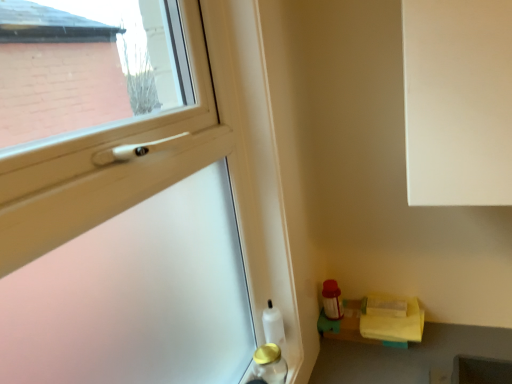
Image resolution: width=512 pixels, height=384 pixels. I want to click on transparent plastic screen door at lower right, so click(x=136, y=297).

This screenshot has width=512, height=384. I want to click on gold metallic bottle at lower left, which appears as the first bottle when viewed from the front, so click(269, 364).

Based on the photo, does gold metallic bottle at lower left, which appears as the 2th bottle when viewed from the back, touch yellow fabric at lower right?

gold metallic bottle at lower left, which appears as the 2th bottle when viewed from the back, is not next to yellow fabric at lower right, and they're not touching.

From the image's perspective, relative to yellow fabric at lower right, is gold metallic bottle at lower left, which appears as the 2th bottle when viewed from the back, above or below?

Clearly, from the image's perspective, gold metallic bottle at lower left, which appears as the 2th bottle when viewed from the back, is below yellow fabric at lower right.

Is gold metallic bottle at lower left, which appears as the 2th bottle when viewed from the back, positioned before yellow fabric at lower right?

Yes.

Is gold metallic bottle at lower left, which appears as the 2th bottle when viewed from the back, taller or shorter than yellow fabric at lower right?

gold metallic bottle at lower left, which appears as the 2th bottle when viewed from the back, is taller than yellow fabric at lower right.

Considering the relative sizes of yellow fabric at lower right and transparent plastic screen door at lower right in the image provided, is yellow fabric at lower right shorter than transparent plastic screen door at lower right?

Correct, yellow fabric at lower right is not as tall as transparent plastic screen door at lower right.

Which of these two, yellow fabric at lower right or transparent plastic screen door at lower right, is bigger?

Bigger between the two is transparent plastic screen door at lower right.

Does yellow fabric at lower right lie behind transparent plastic screen door at lower right?

Yes, yellow fabric at lower right is further from the camera.

This screenshot has height=384, width=512. In order to click on shelf behind the transparent plastic screen door at lower right in this screenshot , I will do `click(378, 321)`.

This screenshot has height=384, width=512. Identify the location of screen door located above the white glossy bottle at lower left, positioned as the second bottle in front-to-back order (from a real-world perspective). [x=136, y=297].

Measure the distance between white glossy bottle at lower left, positioned as the second bottle in front-to-back order, and transparent plastic screen door at lower right.

A distance of 32.44 centimeters exists between white glossy bottle at lower left, positioned as the second bottle in front-to-back order, and transparent plastic screen door at lower right.

From the image's perspective, which is below, white glossy bottle at lower left, positioned as the second bottle in front-to-back order, or transparent plastic screen door at lower right?

From the image's view, white glossy bottle at lower left, positioned as the second bottle in front-to-back order, is below.

Which bottle is the 2nd one when counting from the back of the transparent plastic screen door at lower right? Please provide its 2D coordinates.

[(274, 326)]

In the image, is transparent plastic screen door at lower right positioned in front of or behind white glossy bottle at lower left, positioned as the second bottle in front-to-back order?

In the image, transparent plastic screen door at lower right appears in front of white glossy bottle at lower left, positioned as the second bottle in front-to-back order.

Considering the relative positions of transparent plastic screen door at lower right and white glossy bottle at lower left, the 1th bottle viewed from the back, in the image provided, is transparent plastic screen door at lower right to the left or to the right of white glossy bottle at lower left, the 1th bottle viewed from the back,?

Based on their positions, transparent plastic screen door at lower right is located to the left of white glossy bottle at lower left, the 1th bottle viewed from the back.

Are transparent plastic screen door at lower right and white glossy bottle at lower left, the 1th bottle viewed from the back, making contact?

No, transparent plastic screen door at lower right is not making contact with white glossy bottle at lower left, the 1th bottle viewed from the back.

From the image's perspective, between white glossy bottle at lower left, the 1th bottle viewed from the back, and gold metallic bottle at lower left, which appears as the 2th bottle when viewed from the back, who is located below?

gold metallic bottle at lower left, which appears as the 2th bottle when viewed from the back, from the image's perspective.

At what (x,y) coordinates should I click in order to perform the action: click on bottle below the white glossy bottle at lower left, positioned as the second bottle in front-to-back order (from the image's perspective). Please return your answer as a coordinate pair (x, y). The width and height of the screenshot is (512, 384). Looking at the image, I should click on (269, 364).

Looking at this image, from a real-world perspective, relative to gold metallic bottle at lower left, which appears as the 2th bottle when viewed from the back, is white glossy bottle at lower left, positioned as the second bottle in front-to-back order, vertically above or below?

white glossy bottle at lower left, positioned as the second bottle in front-to-back order, is above gold metallic bottle at lower left, which appears as the 2th bottle when viewed from the back.

How many degrees apart are the facing directions of white glossy bottle at lower left, positioned as the second bottle in front-to-back order, and gold metallic bottle at lower left, which appears as the first bottle when viewed from the front?

They differ by 2.22 degrees in their facing directions.

From the picture: From a real-world perspective, which object stands above the other?

gold metallic bottle at lower left, which appears as the first bottle when viewed from the front, from a real-world perspective.

How different are the orientations of yellow fabric at lower right and gold metallic bottle at lower left, which appears as the first bottle when viewed from the front, in degrees?

The angle between the facing direction of yellow fabric at lower right and the facing direction of gold metallic bottle at lower left, which appears as the first bottle when viewed from the front, is 0.569 degrees.

Is yellow fabric at lower right oriented towards gold metallic bottle at lower left, which appears as the first bottle when viewed from the front?

No, yellow fabric at lower right is not turned towards gold metallic bottle at lower left, which appears as the first bottle when viewed from the front.

Could you measure the distance between yellow fabric at lower right and gold metallic bottle at lower left, which appears as the 2th bottle when viewed from the back?

A distance of 13.27 inches exists between yellow fabric at lower right and gold metallic bottle at lower left, which appears as the 2th bottle when viewed from the back.

Consider the image. How many degrees apart are the facing directions of white glossy bottle at lower left, the 1th bottle viewed from the back, and yellow fabric at lower right?

The facing directions of white glossy bottle at lower left, the 1th bottle viewed from the back, and yellow fabric at lower right are 1.65 degrees apart.

Locate an element on the screen. The height and width of the screenshot is (384, 512). shelf behind the white glossy bottle at lower left, positioned as the second bottle in front-to-back order is located at coordinates (378, 321).

Is white glossy bottle at lower left, the 1th bottle viewed from the back, positioned before yellow fabric at lower right?

Yes, the depth of white glossy bottle at lower left, the 1th bottle viewed from the back, is less than that of yellow fabric at lower right.

Does white glossy bottle at lower left, the 1th bottle viewed from the back, appear on the right side of yellow fabric at lower right?

In fact, white glossy bottle at lower left, the 1th bottle viewed from the back, is to the left of yellow fabric at lower right.

In order to click on shelf located above the gold metallic bottle at lower left, which appears as the first bottle when viewed from the front (from the image's perspective) in this screenshot , I will do `click(378, 321)`.

Find the location of `shelf below the transparent plastic screen door at lower right (from the image's perspective)`. shelf below the transparent plastic screen door at lower right (from the image's perspective) is located at coordinates (378, 321).

Considering their positions, is yellow fabric at lower right positioned closer to gold metallic bottle at lower left, which appears as the 2th bottle when viewed from the back, than transparent plastic screen door at lower right?

transparent plastic screen door at lower right is positioned closer to the anchor gold metallic bottle at lower left, which appears as the 2th bottle when viewed from the back.

From the image, which object appears to be farther from white glossy bottle at lower left, the 1th bottle viewed from the back, gold metallic bottle at lower left, which appears as the first bottle when viewed from the front, or yellow fabric at lower right?

yellow fabric at lower right is positioned further to the anchor white glossy bottle at lower left, the 1th bottle viewed from the back.

Which object lies nearer to the anchor point yellow fabric at lower right, transparent plastic screen door at lower right or white glossy bottle at lower left, the 1th bottle viewed from the back?

Based on the image, white glossy bottle at lower left, the 1th bottle viewed from the back, appears to be nearer to yellow fabric at lower right.

Estimate the real-world distances between objects in this image. Which object is closer to gold metallic bottle at lower left, which appears as the first bottle when viewed from the front, yellow fabric at lower right or white glossy bottle at lower left, the 1th bottle viewed from the back?

white glossy bottle at lower left, the 1th bottle viewed from the back, is positioned closer to the anchor gold metallic bottle at lower left, which appears as the first bottle when viewed from the front.

From the picture: Considering their positions, is transparent plastic screen door at lower right positioned further to white glossy bottle at lower left, positioned as the second bottle in front-to-back order, than gold metallic bottle at lower left, which appears as the 2th bottle when viewed from the back?

transparent plastic screen door at lower right is further to white glossy bottle at lower left, positioned as the second bottle in front-to-back order.

Looking at the image, which one is located closer to yellow fabric at lower right, gold metallic bottle at lower left, which appears as the first bottle when viewed from the front, or white glossy bottle at lower left, positioned as the second bottle in front-to-back order?

white glossy bottle at lower left, positioned as the second bottle in front-to-back order, lies closer to yellow fabric at lower right than the other object.

Based on their spatial positions, is transparent plastic screen door at lower right or yellow fabric at lower right closer to white glossy bottle at lower left, positioned as the second bottle in front-to-back order?

Based on the image, transparent plastic screen door at lower right appears to be nearer to white glossy bottle at lower left, positioned as the second bottle in front-to-back order.

From the image, which object appears to be nearer to transparent plastic screen door at lower right, white glossy bottle at lower left, positioned as the second bottle in front-to-back order, or gold metallic bottle at lower left, which appears as the first bottle when viewed from the front?

Among the two, white glossy bottle at lower left, positioned as the second bottle in front-to-back order, is located nearer to transparent plastic screen door at lower right.

Find the location of a particular element. Image resolution: width=512 pixels, height=384 pixels. bottle between gold metallic bottle at lower left, which appears as the first bottle when viewed from the front, and yellow fabric at lower right, in the horizontal direction is located at coordinates (274, 326).

Find the location of a particular element. This screenshot has width=512, height=384. bottle located between transparent plastic screen door at lower right and white glossy bottle at lower left, the 1th bottle viewed from the back, in the depth direction is located at coordinates (269, 364).